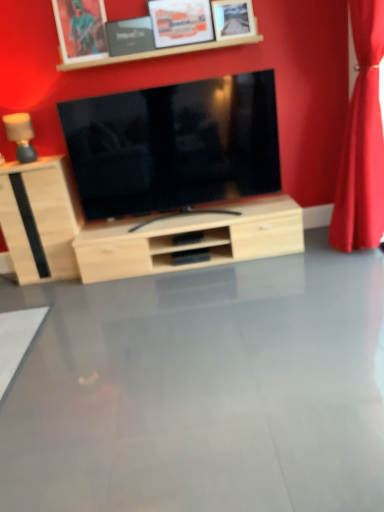
Question: Is brushed metal picture frame at upper center, the first picture frame from the left, thinner than matte wood lamp at left?

Choices:
 (A) no
 (B) yes

Answer: (B)

Question: From a real-world perspective, is brushed metal picture frame at upper center, the first picture frame from the left, under matte wood lamp at left?

Choices:
 (A) no
 (B) yes

Answer: (A)

Question: Is brushed metal picture frame at upper center, the first picture frame from the left, far away from matte wood lamp at left?

Choices:
 (A) yes
 (B) no

Answer: (B)

Question: Does brushed metal picture frame at upper center, the first picture frame from the left, lie in front of matte wood lamp at left?

Choices:
 (A) yes
 (B) no

Answer: (A)

Question: Is brushed metal picture frame at upper center, the first picture frame from the left, at the right side of matte wood lamp at left?

Choices:
 (A) yes
 (B) no

Answer: (A)

Question: Looking at their shapes, would you say light wood cabinet at left is wider or thinner than wooden picture frame at upper center, positioned as the third picture frame in left-to-right order?

Choices:
 (A) thin
 (B) wide

Answer: (B)

Question: Is light wood cabinet at left bigger or smaller than wooden picture frame at upper center, the 2th picture frame from the right?

Choices:
 (A) big
 (B) small

Answer: (A)

Question: Relative to wooden picture frame at upper center, positioned as the third picture frame in left-to-right order, is light wood cabinet at left in front or behind?

Choices:
 (A) front
 (B) behind

Answer: (B)

Question: From a real-world perspective, relative to wooden picture frame at upper center, positioned as the third picture frame in left-to-right order, is light wood cabinet at left vertically above or below?

Choices:
 (A) above
 (B) below

Answer: (B)

Question: In terms of height, does matte black picture frame at upper center, the third picture frame from the right, look taller or shorter compared to red velvet curtain at right?

Choices:
 (A) short
 (B) tall

Answer: (A)

Question: Would you say matte black picture frame at upper center, the third picture frame from the right, is to the left or to the right of red velvet curtain at right in the picture?

Choices:
 (A) right
 (B) left

Answer: (B)

Question: Relative to red velvet curtain at right, is matte black picture frame at upper center, acting as the 2th picture frame starting from the left, in front or behind?

Choices:
 (A) front
 (B) behind

Answer: (B)

Question: Is matte black picture frame at upper center, the third picture frame from the right, bigger or smaller than red velvet curtain at right?

Choices:
 (A) small
 (B) big

Answer: (A)

Question: Is wooden picture frame at upper center, the 2th picture frame from the right, taller or shorter than matte wood lamp at left?

Choices:
 (A) tall
 (B) short

Answer: (A)

Question: From the image's perspective, is wooden picture frame at upper center, the 2th picture frame from the right, positioned above or below matte wood lamp at left?

Choices:
 (A) below
 (B) above

Answer: (B)